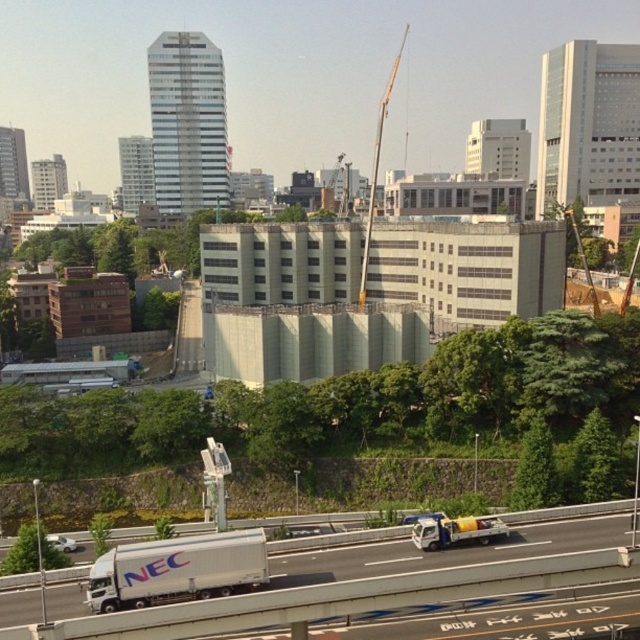
Between white glossy truck at lower left and metallic gray crane at center, which one has less height?

Standing shorter between the two is white glossy truck at lower left.

Identify the location of white glossy truck at lower left. (385, 584).

Between point (465, 550) and point (422, 516), which one is positioned in front?

Point (465, 550)

Which is in front, point (192, 632) or point (432, 525)?

Point (192, 632)

What are the coordinates of `white glossy truck at lower left` in the screenshot? It's located at (385, 584).

Between white matte trailer truck at lower left and metallic gray crane at center, which one has less height?

With less height is white matte trailer truck at lower left.

Does white matte trailer truck at lower left have a smaller size compared to metallic gray crane at center?

Indeed, white matte trailer truck at lower left has a smaller size compared to metallic gray crane at center.

Is point (99, 589) less distant than point (371, 189)?

Yes, it is in front of point (371, 189).

Find the location of a particular element. white matte trailer truck at lower left is located at coordinates (177, 570).